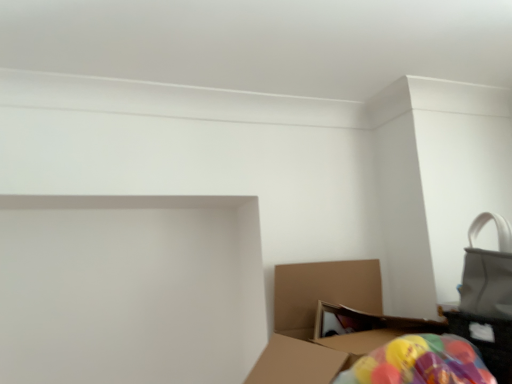
Describe the element at coordinates (315, 321) in the screenshot. The image size is (512, 384). I see `cardboard box at lower right` at that location.

In the scene shown: What is the approximate height of cardboard box at lower right?

16.52 inches.

This screenshot has width=512, height=384. I want to click on cardboard box at lower right, so click(x=315, y=321).

At what (x,y) coordinates should I click in order to perform the action: click on cardboard box at lower right. Please return your answer as a coordinate pair (x, y). Looking at the image, I should click on (315, 321).